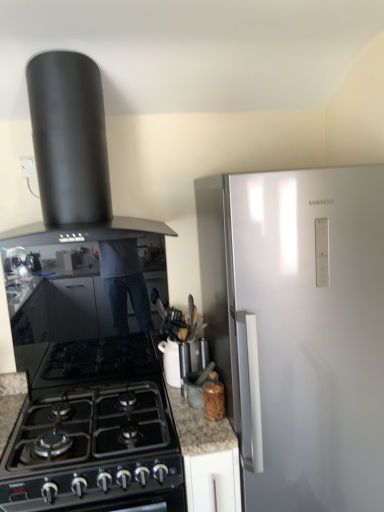
Question: Is black glass gas stove at lower left wider or thinner than white glossy teapot at center, which ranks as the 2th kitchen appliance in left-to-right order?

Choices:
 (A) wide
 (B) thin

Answer: (A)

Question: In the image, is black glass gas stove at lower left on the left side or the right side of white glossy teapot at center, the second kitchen appliance viewed from the top?

Choices:
 (A) right
 (B) left

Answer: (B)

Question: Based on their relative distances, which object is farther from the white glossy teapot at center, the 2th kitchen appliance in the right-to-left sequence?

Choices:
 (A) black matte chimney hood at upper left, marked as the 3th kitchen appliance in a bottom-to-top arrangement
 (B) black glass gas stove at lower left
 (C) brown glass bottle at lower center, the first kitchen appliance positioned from the bottom

Answer: (A)

Question: Estimate the real-world distances between objects in this image. Which object is farther from the white glossy teapot at center, arranged as the second kitchen appliance when ordered from the bottom?

Choices:
 (A) black glass gas stove at lower left
 (B) black matte chimney hood at upper left, positioned as the first kitchen appliance in left-to-right order
 (C) brown glass bottle at lower center, which is counted as the third kitchen appliance, starting from the left

Answer: (B)